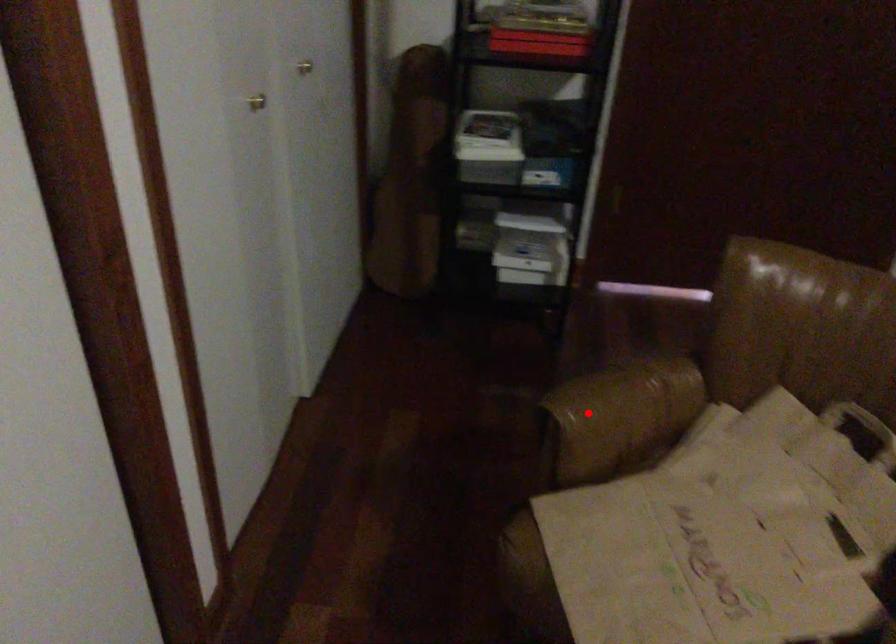
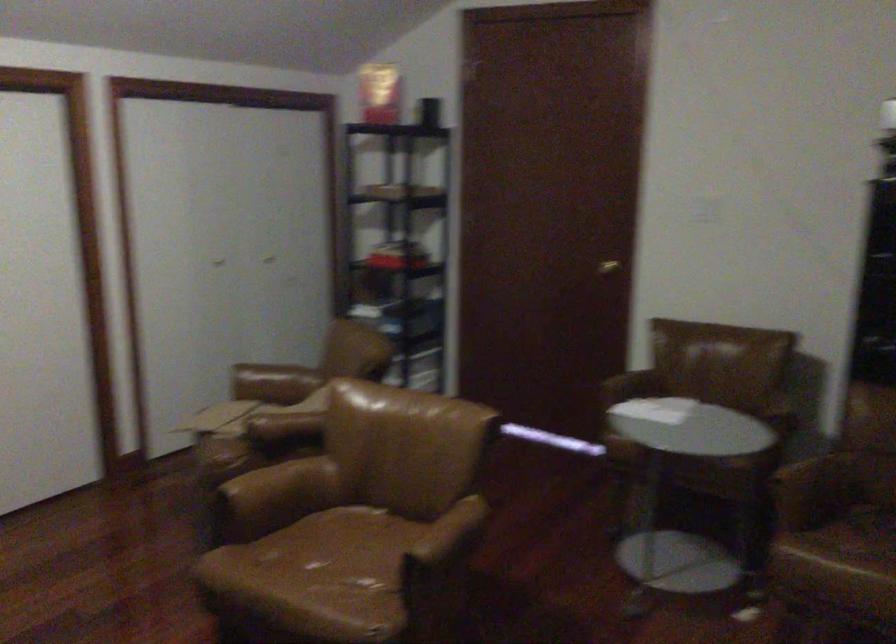
Locate, in the second image, the point that corresponds to the highlighted location in the first image.

(273, 383)